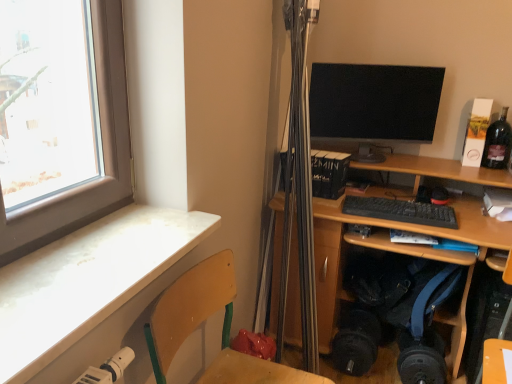
At what (x,y) coordinates should I click in order to perform the action: click on vacant region above white marble desk at lower left, the first desk positioned from the front (from a real-world perspective). Please return your answer as a coordinate pair (x, y). The width and height of the screenshot is (512, 384). Looking at the image, I should click on coord(80,262).